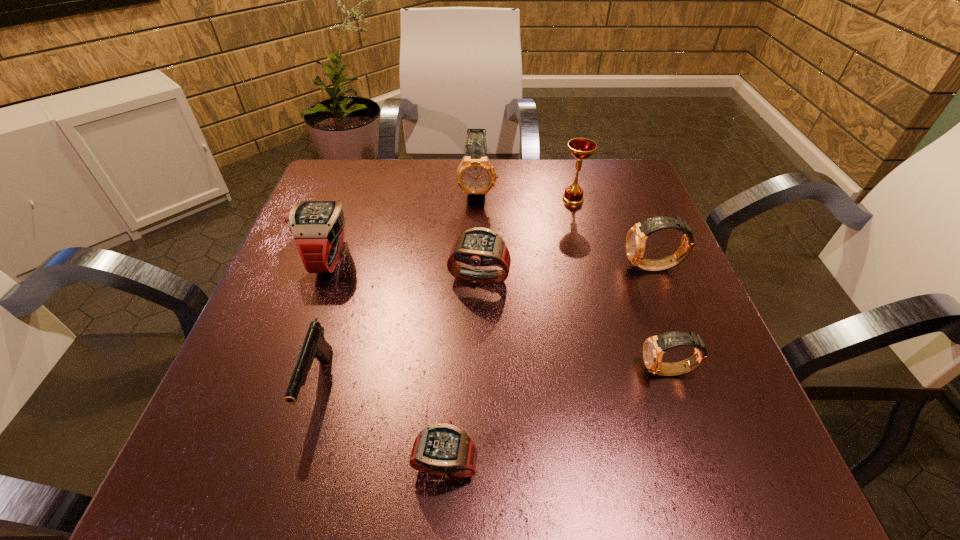
I want to click on vacant region located 0.160m on the face of the fifth farthest watch, so click(x=544, y=372).

Image resolution: width=960 pixels, height=540 pixels. I want to click on free space located on the face of the fifth farthest watch, so click(568, 372).

This screenshot has height=540, width=960. I want to click on free space located at the muzzle of the pistol, so click(x=294, y=469).

The height and width of the screenshot is (540, 960). What are the coordinates of `vacant area situated 0.200m on the right of the shortest watch` in the screenshot? It's located at (620, 465).

Where is `watch present at the far edge`? Image resolution: width=960 pixels, height=540 pixels. watch present at the far edge is located at coordinates (475, 176).

Where is `chalice at the far edge`? The height and width of the screenshot is (540, 960). chalice at the far edge is located at coordinates (581, 148).

Identify the location of object positioned at the near edge. The height and width of the screenshot is (540, 960). (444, 449).

Identify the location of watch at the left edge. The width and height of the screenshot is (960, 540). (317, 227).

Locate an element on the screen. pistol that is positioned at the left edge is located at coordinates (315, 346).

Where is `chalice that is at the right edge`? chalice that is at the right edge is located at coordinates (581, 148).